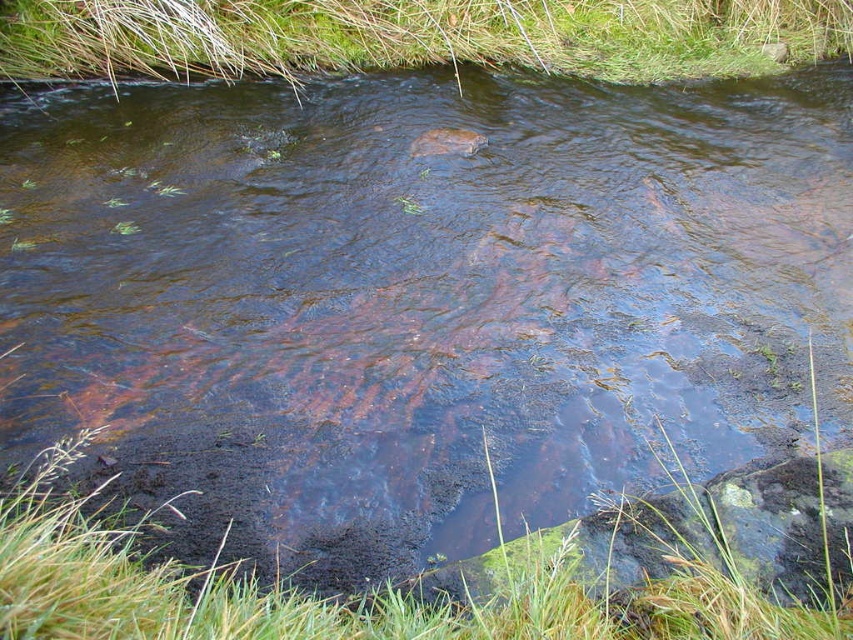
You are standing at the center of the stream and want to step onto the nearest solid ground. Which direction should you move to reach the green grass at lower left?

You should move towards the lower left direction to reach the green grass at lower left, as it is located at point (352, 596) in the image.

You are a hiker trying to cross the stream and notice the green grass at lower left and green algae at upper center. Which one is wider?

The green grass at lower left is wider than the green algae at upper center.